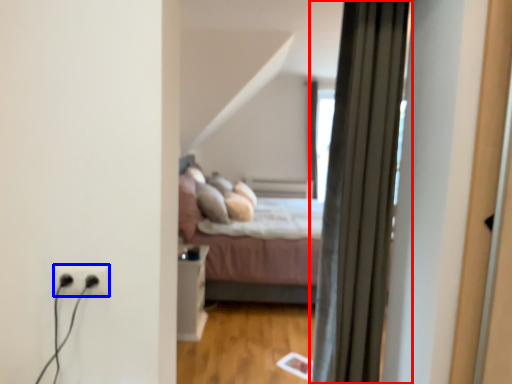
Question: Which of the following is the closest to the observer, curtain (highlighted by a red box) or electric outlet (highlighted by a blue box)?

Choices:
 (A) curtain
 (B) electric outlet

Answer: (B)